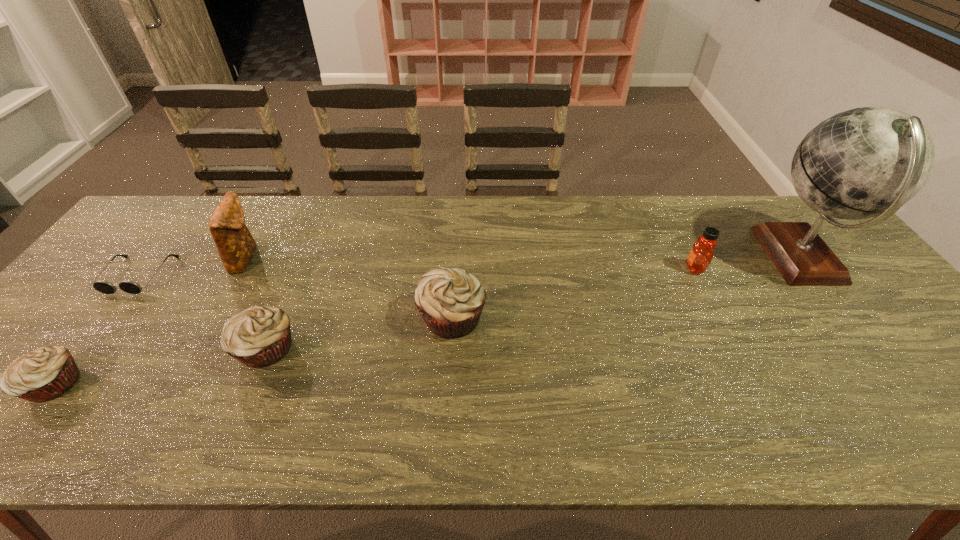
In order to click on free spot between the leftmost muffin and the second shortest muffin in this screenshot , I will do tap(160, 367).

This screenshot has width=960, height=540. In order to click on unoccupied position between the fifth object from left to right and the tallest object in this screenshot , I will do [626, 287].

At what (x,y) coordinates should I click in order to perform the action: click on the third closest object to the leftmost muffin. Please return your answer as a coordinate pair (x, y). The height and width of the screenshot is (540, 960). Looking at the image, I should click on (236, 246).

Identify the location of object that is the sixth nearest to the clutch bag. The image size is (960, 540). (866, 162).

This screenshot has height=540, width=960. In order to click on the second closest muffin to the leftmost muffin in this screenshot , I will do `click(450, 301)`.

Where is `muffin object that ranks as the second closest to the second shortest object`? The width and height of the screenshot is (960, 540). muffin object that ranks as the second closest to the second shortest object is located at coordinates (450, 301).

Locate an element on the screen. The image size is (960, 540). vacant point that satisfies the following two spatial constraints: 1. on the back side of the third object from right to left; 2. on the open side of the sixth shortest object is located at coordinates (455, 258).

At what (x,y) coordinates should I click in order to perform the action: click on vacant region that satisfies the following two spatial constraints: 1. on the front-facing side of the fifth object from left to right; 2. on the left side of the shortest object. Please return your answer as a coordinate pair (x, y). This screenshot has height=540, width=960. Looking at the image, I should click on (107, 318).

Identify the location of free location that satisfies the following two spatial constraints: 1. at the equator of the globe; 2. on the front-facing side of the sunglasses. This screenshot has width=960, height=540. (813, 275).